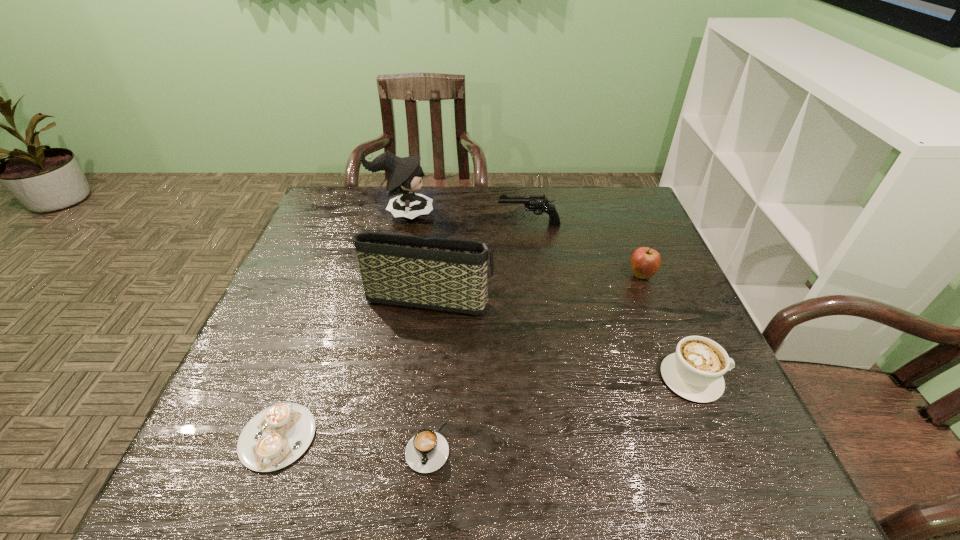
This screenshot has width=960, height=540. What are the coordinates of `vacant space located at the face of the doll` in the screenshot? It's located at (562, 214).

Locate an element on the screen. The height and width of the screenshot is (540, 960). blank space located 0.220m on the front of the handbag is located at coordinates (416, 398).

At what (x,y) coordinates should I click in order to perform the action: click on free space located at the end of the barrel of the gun. Please return your answer as a coordinate pair (x, y). The height and width of the screenshot is (540, 960). Looking at the image, I should click on (372, 224).

You are a GUI agent. You are given a task and a screenshot of the screen. Output one action in this format:
    pyautogui.click(x=<x>, y=<y>)
    Task: Click on the free space located 0.240m at the end of the barrel of the gun
    This screenshot has width=960, height=540.
    Given the screenshot: What is the action you would take?
    (x=419, y=224)

Locate an element on the screen. vacant space located at the end of the barrel of the gun is located at coordinates (428, 224).

You are a GUI agent. You are given a task and a screenshot of the screen. Output one action in this format:
    pyautogui.click(x=<x>, y=<y>)
    Task: Click on the free region located on the left of the apple
    
    Given the screenshot: What is the action you would take?
    pos(484,275)

The image size is (960, 540). Identify the location of free space located 0.350m on the back of the leftmost cappuccino. (333, 285).

Identify the location of doll that is at the far edge. This screenshot has width=960, height=540. (405, 175).

Identify the location of gun that is at the far edge. The height and width of the screenshot is (540, 960). (534, 203).

Image resolution: width=960 pixels, height=540 pixels. Identify the location of object that is at the left edge. (277, 436).